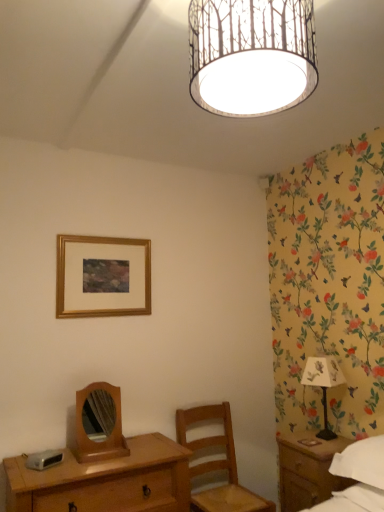
Locate an element on the screen. This screenshot has width=384, height=512. vacant area that is in front of wooden mirror at center is located at coordinates (94, 470).